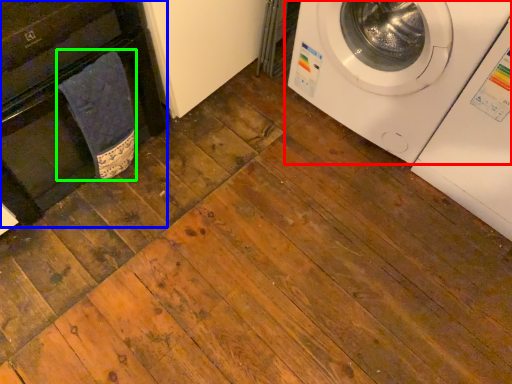
Question: Which object is the farthest from washing machine (highlighted by a red box)? Choose among these: dish washer (highlighted by a blue box) or material (highlighted by a green box).

Choices:
 (A) dish washer
 (B) material

Answer: (A)